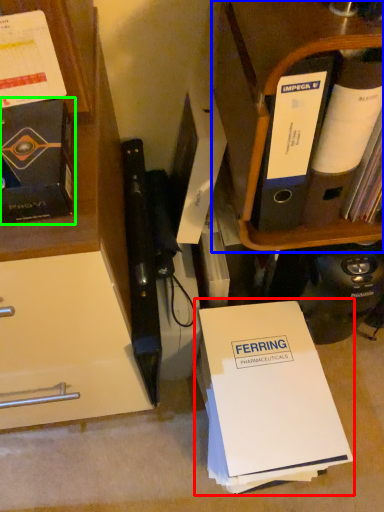
Question: Which is nearer to the paperback book (highlighted by a red box)? shelf (highlighted by a blue box) or book (highlighted by a green box).

Choices:
 (A) shelf
 (B) book

Answer: (A)